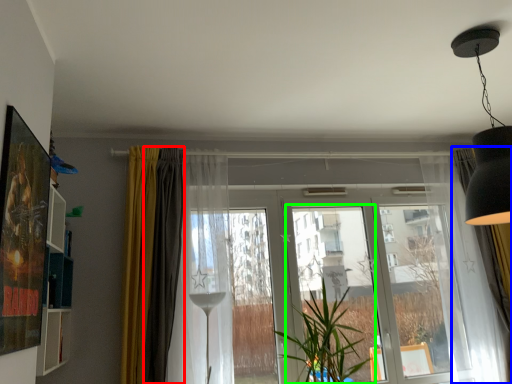
Question: Which object is positioned farthest from curtain (highlighted by a red box)? Select from curtain (highlighted by a blue box) and screen door (highlighted by a green box).

Choices:
 (A) curtain
 (B) screen door

Answer: (A)